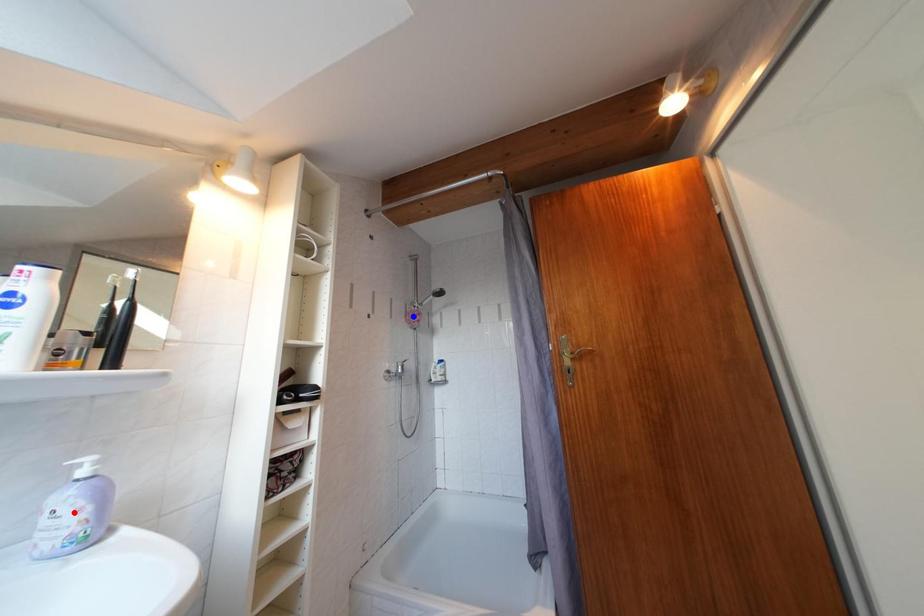
Question: Which of the two points in the image is closer to the camera?

Choices:
 (A) Blue point is closer.
 (B) Red point is closer.

Answer: (B)